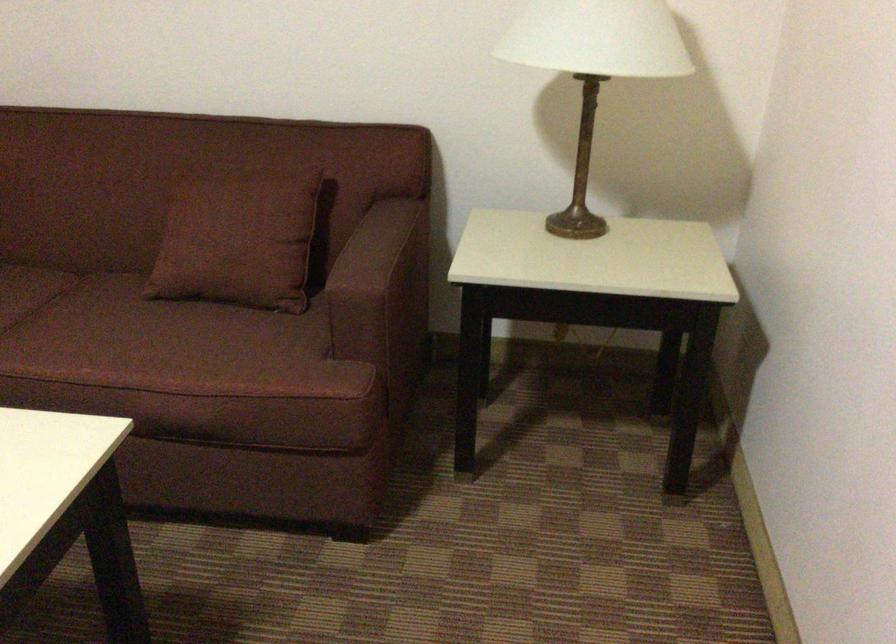
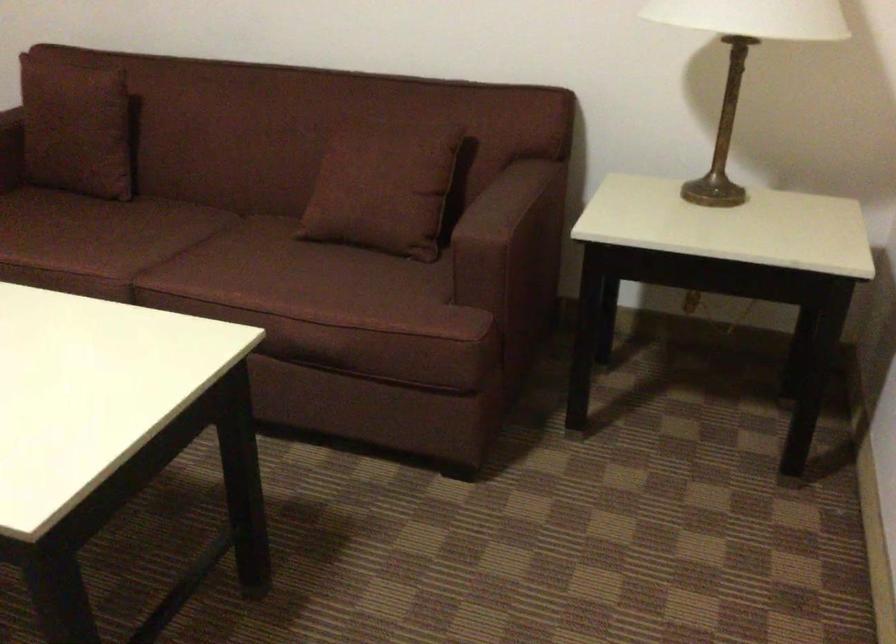
The images are taken continuously from a first-person perspective. In which direction are you moving?

The cameraman moved toward right, backward.